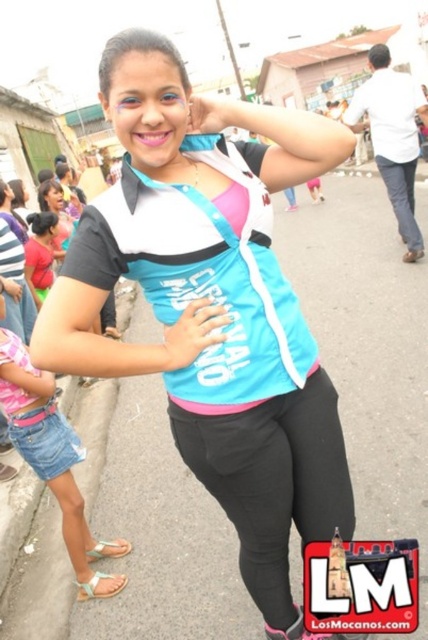
Question: Which object appears closest to the camera in this image?

Choices:
 (A) matte black shirt at left
 (B) black leggings at center
 (C) denim shorts at lower left

Answer: (B)

Question: Can you confirm if matte black shirt at left is positioned to the right of matte pink shirt at left?

Choices:
 (A) yes
 (B) no

Answer: (A)

Question: From the image, what is the correct spatial relationship of denim shorts at lower left in relation to matte pink shirt at left?

Choices:
 (A) below
 (B) above

Answer: (A)

Question: Which object appears farthest from the camera in this image?

Choices:
 (A) matte black shirt at left
 (B) matte pink shirt at left

Answer: (B)

Question: Is black leggings at center wider than matte pink shirt at left?

Choices:
 (A) yes
 (B) no

Answer: (B)

Question: Which object appears farthest from the camera in this image?

Choices:
 (A) matte black shirt at left
 (B) denim shorts at lower left
 (C) black leggings at center

Answer: (A)